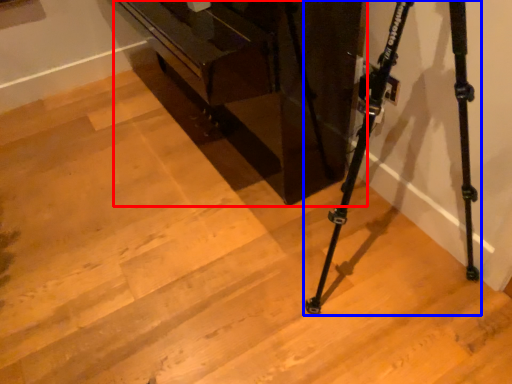
Question: Among these objects, which one is nearest to the camera, furniture (highlighted by a red box) or tripod (highlighted by a blue box)?

Choices:
 (A) furniture
 (B) tripod

Answer: (B)